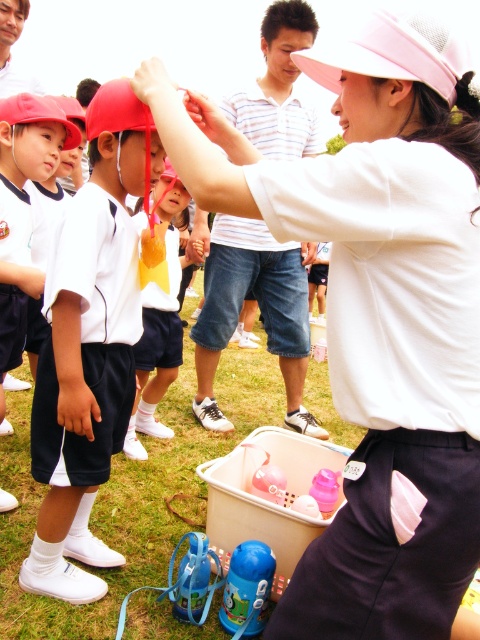
Question: Which point is closer to the camera?

Choices:
 (A) (309, 112)
 (B) (260, 564)

Answer: (B)

Question: Which point is farther to the camera?

Choices:
 (A) white matte visor at upper center
 (B) blue plastic thermos at lower center
 (C) matte white shorts at lower left
 (D) white matte baseball cap at center

Answer: (C)

Question: Which of the following is the farthest from the observer?

Choices:
 (A) white matte visor at upper center
 (B) matte red baseball hat at upper left
 (C) blue plastic thermos at lower center

Answer: (B)

Question: Does white matte baseball cap at center appear over matte white shorts at lower left?

Choices:
 (A) no
 (B) yes

Answer: (A)

Question: Can you confirm if matte white shorts at lower left is thinner than pink mesh baseball hat at upper center?

Choices:
 (A) yes
 (B) no

Answer: (A)

Question: Where is matte yellow cap at center located in relation to matte red baseball hat at upper left in the image?

Choices:
 (A) above
 (B) below

Answer: (B)